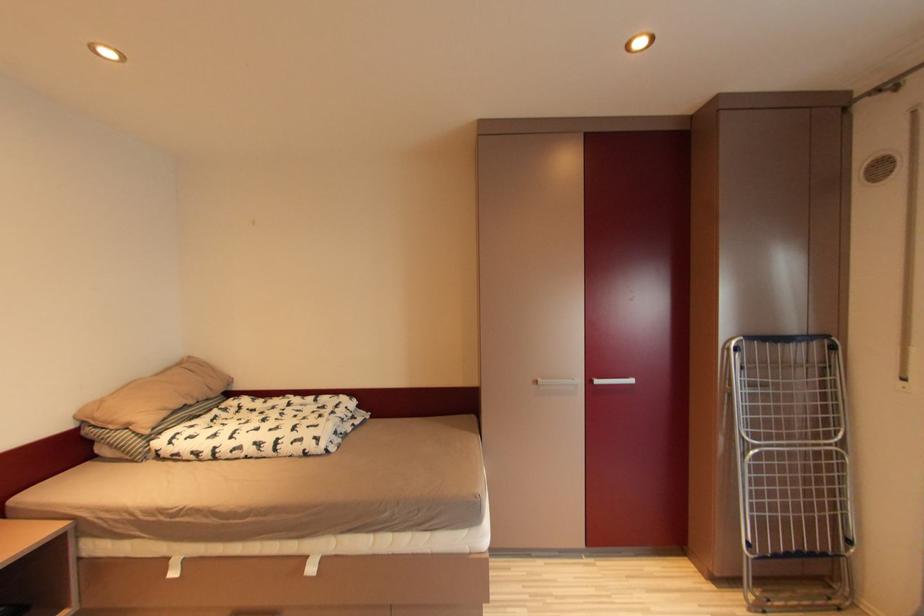
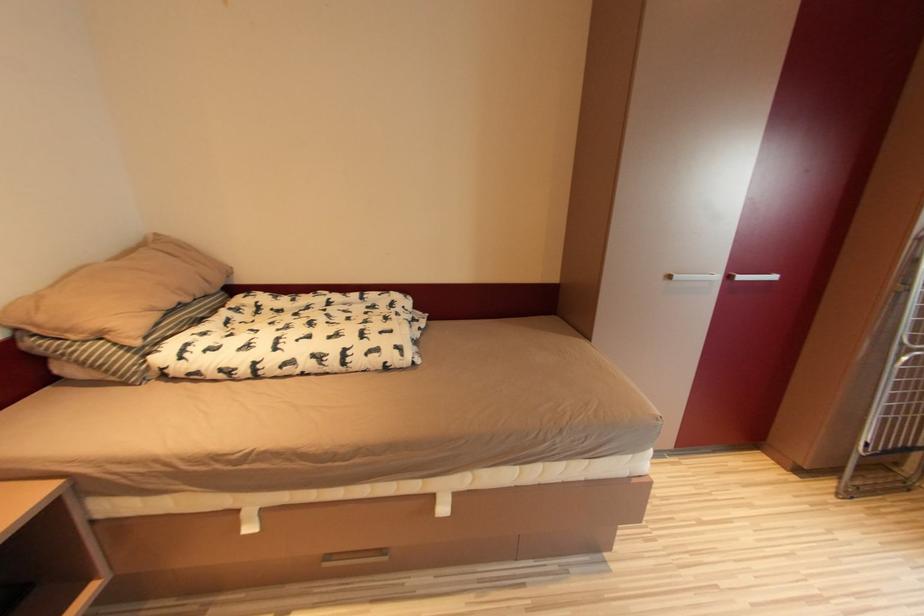
In a continuous first-person perspective shot, in which direction is the camera moving?

The cameraman moved toward left, forward.